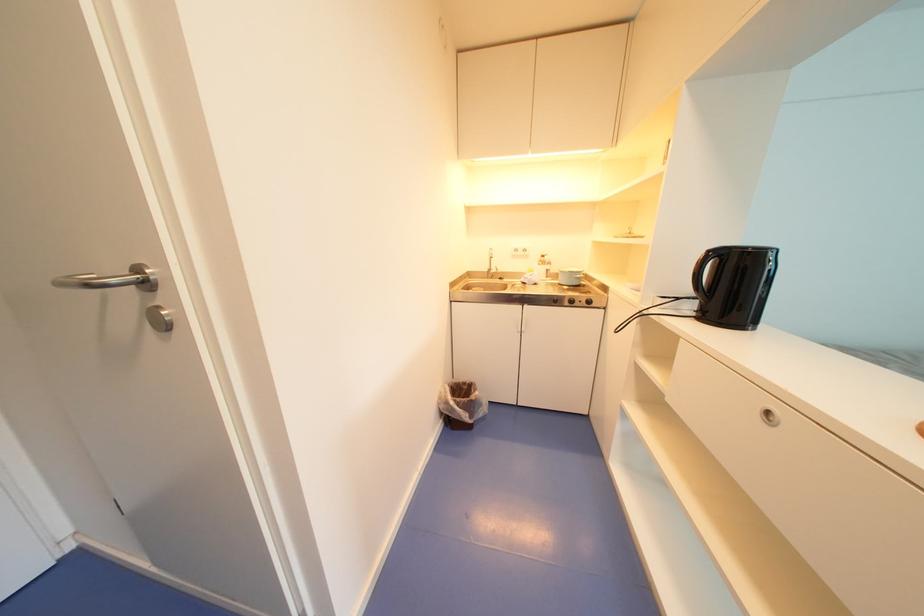
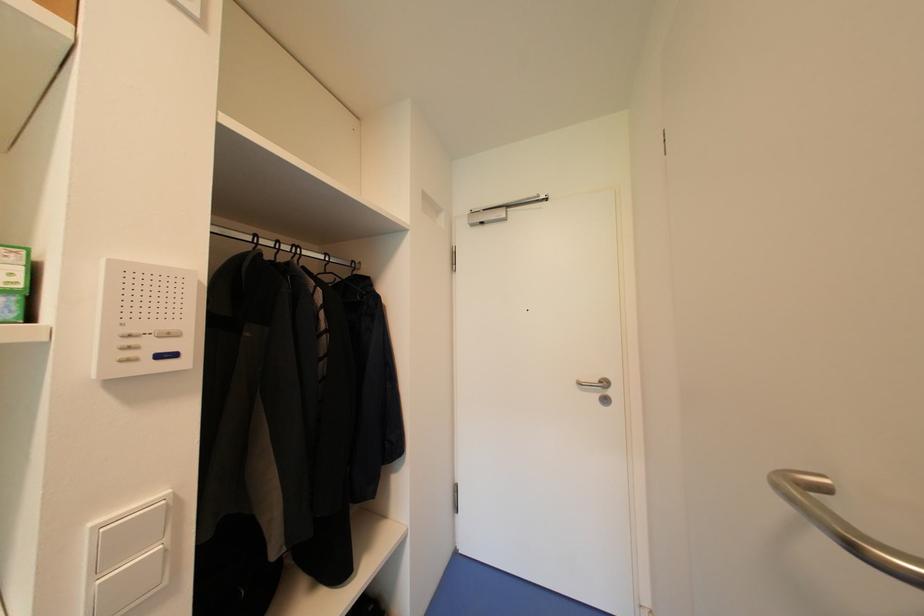
Question: The camera is either moving clockwise (left) or counter-clockwise (right) around the object. The first image is from the beginning of the video and the second image is from the end. Is the camera moving left or right when shooting the video?

Choices:
 (A) Left
 (B) Right

Answer: (B)